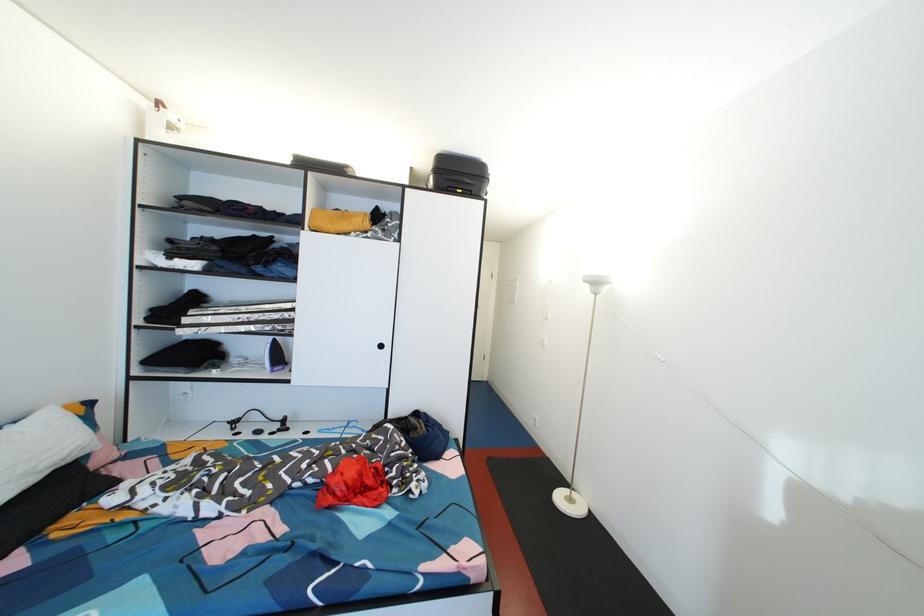
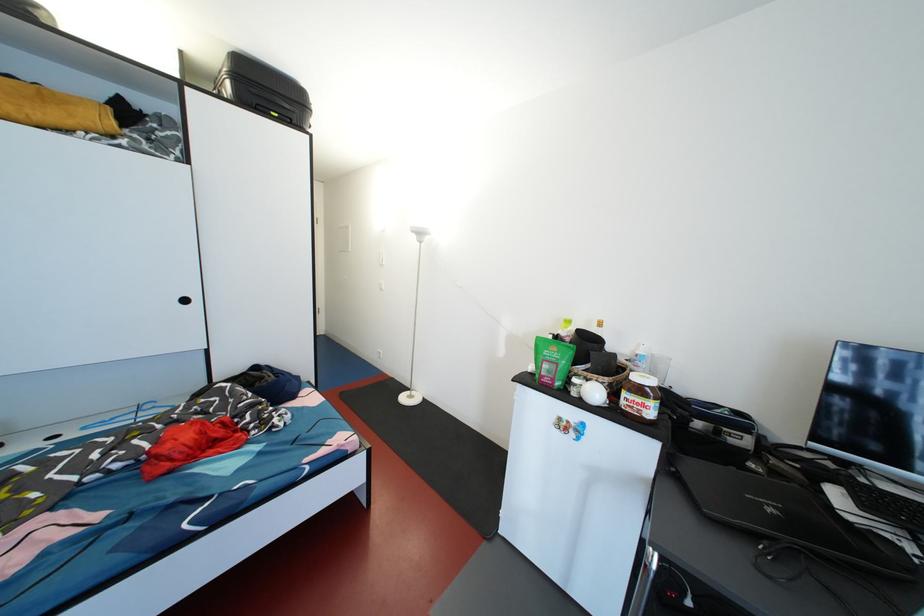
Locate, in the second image, the point that corresponds to point (593, 292) in the first image.

(420, 241)